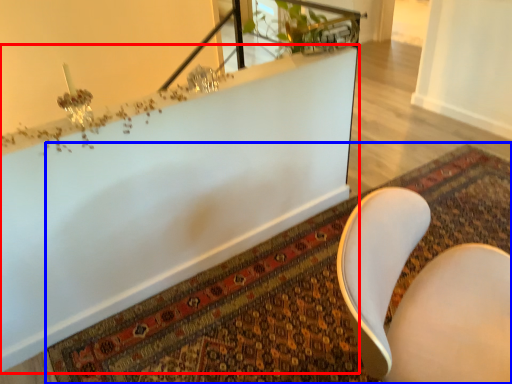
Question: Which of the following is the farthest to the observer, bathtub (highlighted by a red box) or mat (highlighted by a blue box)?

Choices:
 (A) bathtub
 (B) mat

Answer: (B)